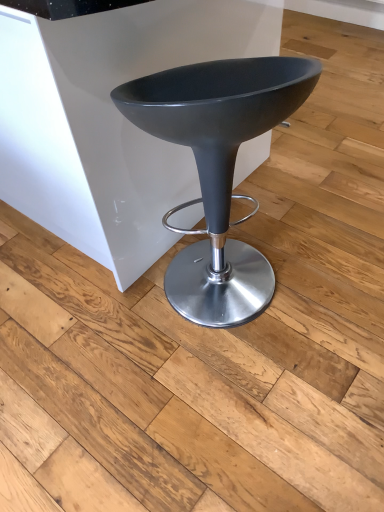
In order to face matte black stool at center, should I rotate leftwards or rightwards?

Rotate right and turn 3.015 degrees.

Where is `matte black stool at center`? This screenshot has width=384, height=512. matte black stool at center is located at coordinates (218, 169).

Image resolution: width=384 pixels, height=512 pixels. What do you see at coordinates (218, 169) in the screenshot?
I see `matte black stool at center` at bounding box center [218, 169].

At what (x,y) coordinates should I click in order to perform the action: click on matte black stool at center. Please return your answer as a coordinate pair (x, y). This screenshot has width=384, height=512. Looking at the image, I should click on (218, 169).